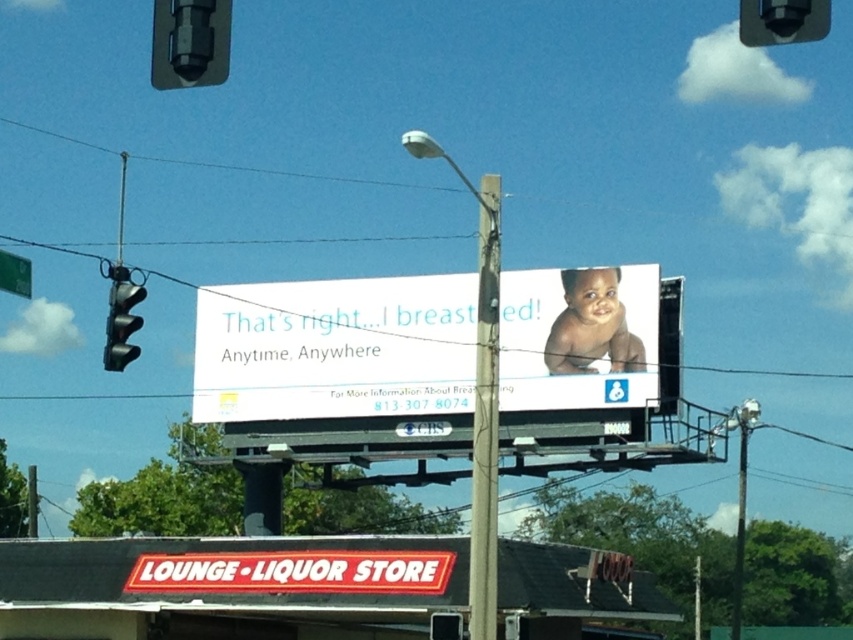
You are a pedestrian standing at the intersection. You want to take a photo of the matte white billboard at center without including the metallic black traffic light at upper left in the frame. Is the billboard positioned in a way that allows this?

The matte white billboard at center is positioned under the metallic black traffic light at upper left, so if you position yourself below the traffic light and aim your camera upward, you can capture the billboard without including the traffic light in the frame.

You are a pedestrian looking at the street signs and billboards. You see the matte white billboard at center and the green plastic street sign at upper left. Which one is located to the right of the other?

The matte white billboard at center is positioned on the right side of green plastic street sign at upper left.